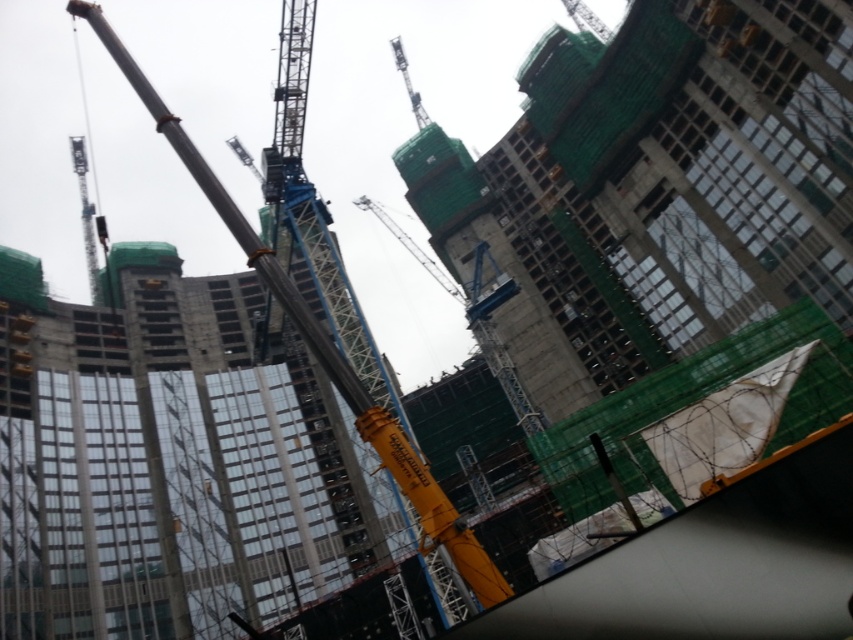
Does concrete construction at center have a smaller size compared to yellow metallic crane at center?

Incorrect, concrete construction at center is not smaller in size than yellow metallic crane at center.

Is point (418, 144) positioned in front of point (271, 276)?

No, (418, 144) is further to viewer.

Is point (828, 404) farther from viewer compared to point (308, 314)?

Yes, point (828, 404) is farther from viewer.

Image resolution: width=853 pixels, height=640 pixels. Find the location of `concrete construction at center`. concrete construction at center is located at coordinates (664, 202).

Measure the distance between concrete construction crane at center and camera.

concrete construction crane at center is 65.67 meters from camera.

The width and height of the screenshot is (853, 640). Find the location of `concrete construction crane at center`. concrete construction crane at center is located at coordinates (167, 461).

Between concrete construction at center and concrete construction crane at center, which one has less height?

With less height is concrete construction crane at center.

Measure the distance between concrete construction at center and camera.

concrete construction at center is 47.83 meters away from camera.

Which is in front, point (606, 385) or point (86, 312)?

Point (606, 385) is more forward.

The width and height of the screenshot is (853, 640). Find the location of `concrete construction at center`. concrete construction at center is located at coordinates (664, 202).